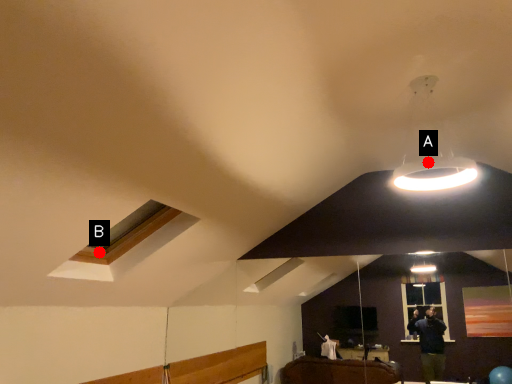
Question: Two points are circled on the image, labeled by A and B beside each circle. Which of the following is the farthest from the observer?

Choices:
 (A) A is further
 (B) B is further

Answer: (A)